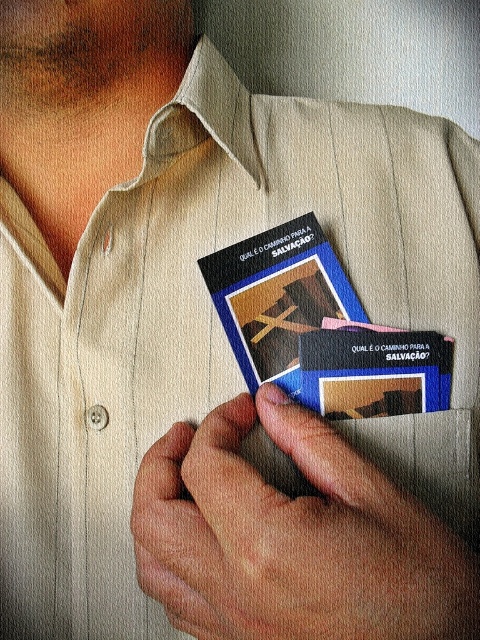
Does smooth skin hand at center have a greater width compared to blue cardboard business card at center?

Yes.

Can you confirm if smooth skin hand at center is positioned below blue cardboard business card at center?

Yes, smooth skin hand at center is below blue cardboard business card at center.

Where is `smooth skin hand at center`? Image resolution: width=480 pixels, height=640 pixels. smooth skin hand at center is located at coordinates (292, 538).

Does smooth skin hand at center have a lesser width compared to blue glossy book at center?

In fact, smooth skin hand at center might be wider than blue glossy book at center.

Which is below, smooth skin hand at center or blue glossy book at center?

Positioned lower is smooth skin hand at center.

Which is in front, point (314, 524) or point (350, 358)?

Point (314, 524) is more forward.

The image size is (480, 640). Identify the location of smooth skin hand at center. (292, 538).

Who is lower down, blue glossy book at center or blue cardboard business card at center?

blue cardboard business card at center is below.

Find the location of `blue glossy book at center`. blue glossy book at center is located at coordinates (320, 330).

Identify the location of blue glossy book at center. The height and width of the screenshot is (640, 480). (320, 330).